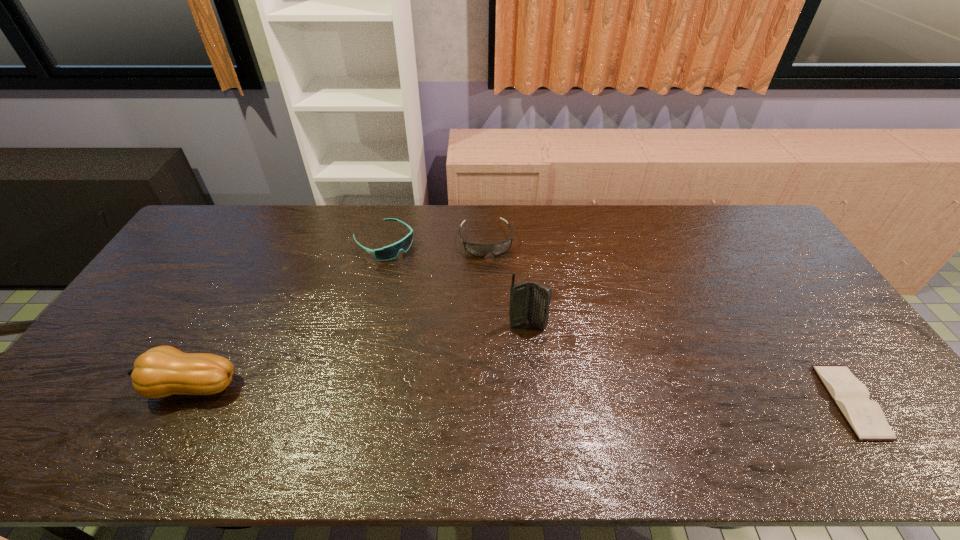
You are a GUI agent. You are given a task and a screenshot of the screen. Output one action in this format:
    pyautogui.click(x=<x>, y=<y>)
    Task: Click on the free space on the desktop that is between the leftmost object and the rightmost object and is positioned on the lenses of the goggles
    This screenshot has height=540, width=960.
    Given the screenshot: What is the action you would take?
    pyautogui.click(x=516, y=394)

This screenshot has width=960, height=540. Find the location of `vacant space on the desktop that is between the leftmost object and the diary and is positioned on the keyboard of the tallest object`. vacant space on the desktop that is between the leftmost object and the diary and is positioned on the keyboard of the tallest object is located at coordinates (573, 395).

The height and width of the screenshot is (540, 960). Identify the location of free spot on the desktop that is between the fourth shortest object and the shortest object and is positioned on the front-facing side of the fourth object from right to left. (576, 395).